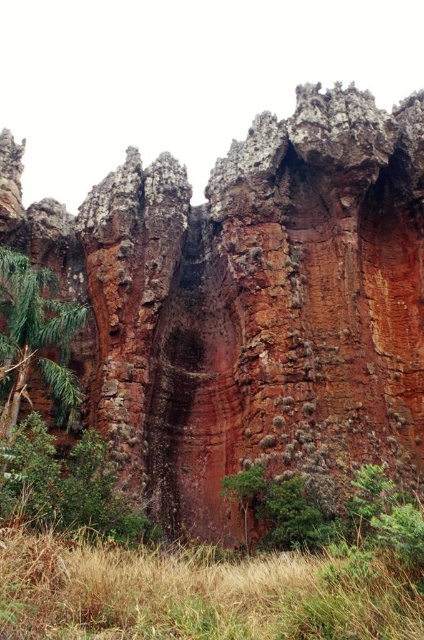
Is brown dry grass at lower center to the left of green leafy tree at left from the viewer's perspective?

Incorrect, brown dry grass at lower center is not on the left side of green leafy tree at left.

Who is taller, brown dry grass at lower center or green leafy tree at left?

Standing taller between the two is green leafy tree at left.

Who is more forward, (36, 596) or (16, 259)?

Point (36, 596) is in front.

Where is `brown dry grass at lower center`? brown dry grass at lower center is located at coordinates (195, 595).

What do you see at coordinates (251, 305) in the screenshot? This screenshot has height=640, width=424. I see `rusty rock cliff at center` at bounding box center [251, 305].

Which is more to the right, rusty rock cliff at center or brown dry grass at lower center?

rusty rock cliff at center is more to the right.

Locate an element on the screen. rusty rock cliff at center is located at coordinates (251, 305).

Which is above, rusty rock cliff at center or green leafy tree at left?

rusty rock cliff at center

Which is in front, point (97, 356) or point (8, 365)?

Point (8, 365) is in front.

Who is more forward, (284, 268) or (8, 426)?

Point (8, 426) is more forward.

I want to click on rusty rock cliff at center, so click(251, 305).